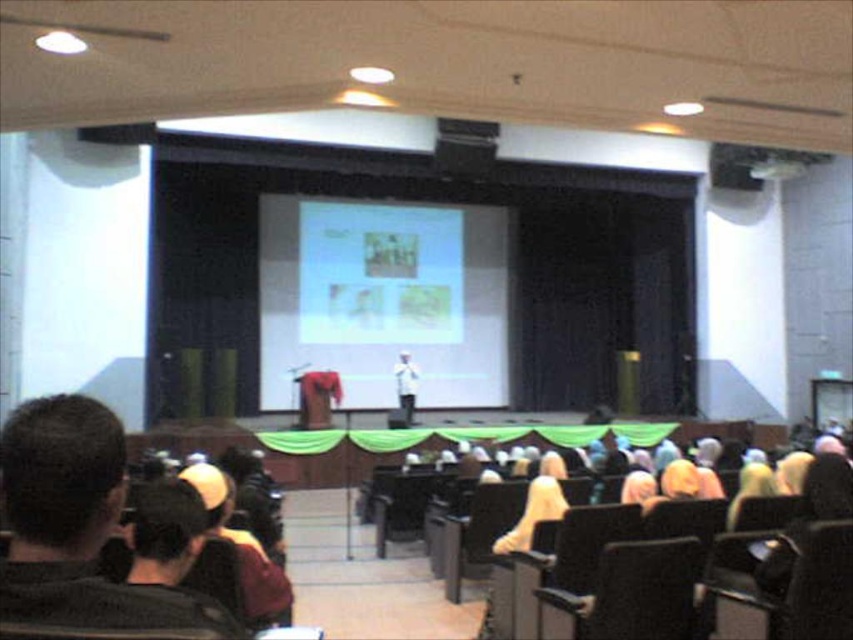
You are sitting in the audience of the lecture hall and want to estimate how far the white glossy screen at center is from your current position. Based on the information provided, what is the approximate distance in meters?

The white glossy screen at center is approximately 14.74 meters away from the camera, so it is roughly the same distance from your current position in the audience.

You are an event organizer and need to set up a new banner. The banner is 1.2 meters wide. Can the banner fit on the white fabric at center if the metallic projector at upper right is already there?

The white fabric at center is bigger than the metallic projector at upper right. Since the banner is 1.2 meters wide and the white fabric is larger than the projector, it is likely that the banner can fit on the white fabric at center provided the projector does not obstruct the space. However, exact dimensions of the fabric are needed for certainty.